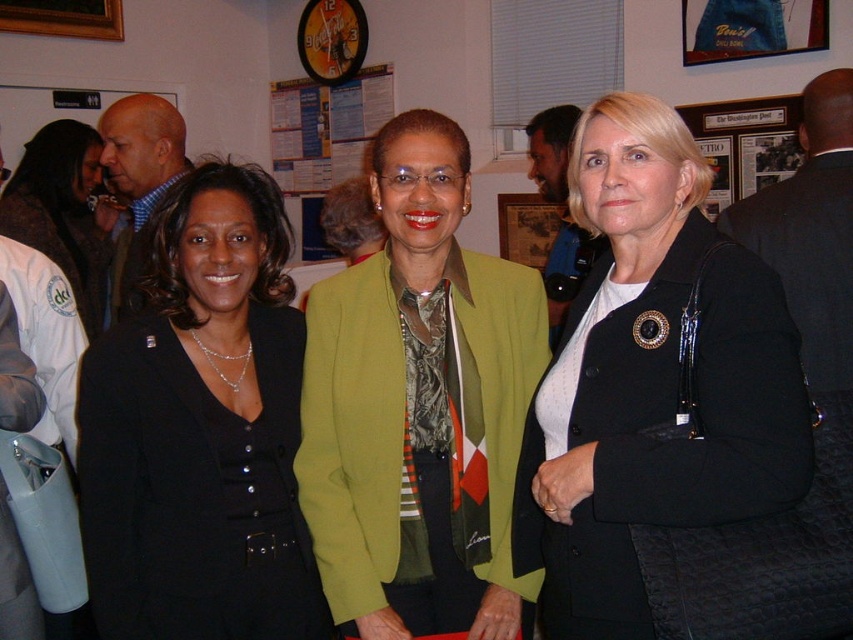
You are an interior designer assessing the wall decorations in the scene. The paper posters at center and the denim fabric picture frame at upper right are both on the wall. Which object is taller?

The paper posters at center is much taller than the denim fabric picture frame at upper right.

You are standing in the room where the three women are posing. You need to find the paper posters at center. According to the scene, where should you look to locate them?

The paper posters at center are located at point (325, 128), so you should look there to find them.